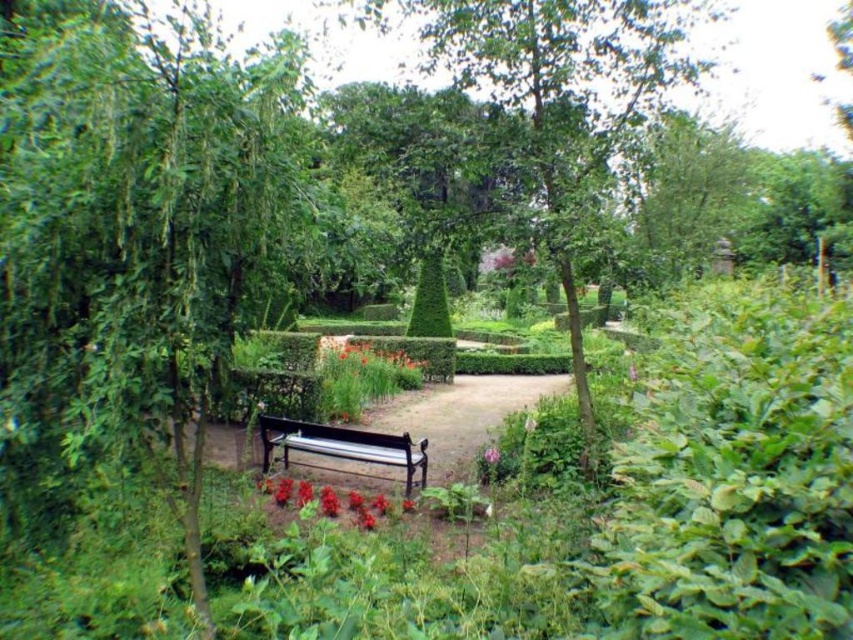
Consider the image. You are planning to plant a new flower bed in the garden. You have two options for placement based on the current layout. The green leafy tree at center and the pink matte flower at center are both in the central area. Which object is positioned higher relative to the other?

The green leafy tree at center is located above the pink matte flower at center, so it is positioned higher.

You are a gardener who wants to place a new statue between the glossy red flowers at lower center and the pink matte flower at center. Which flower should you place the statue closer to if you want it to be closer to the viewer?

You should place the statue closer to the glossy red flowers at lower center because they are closer to the viewer than the pink matte flower at center.